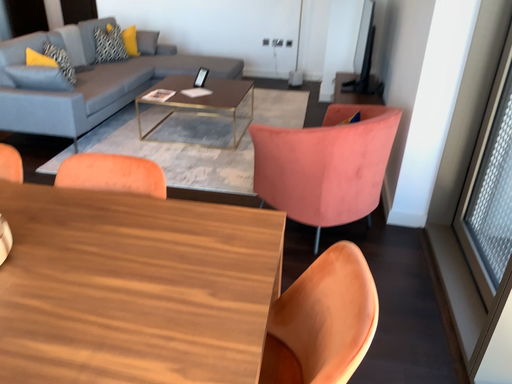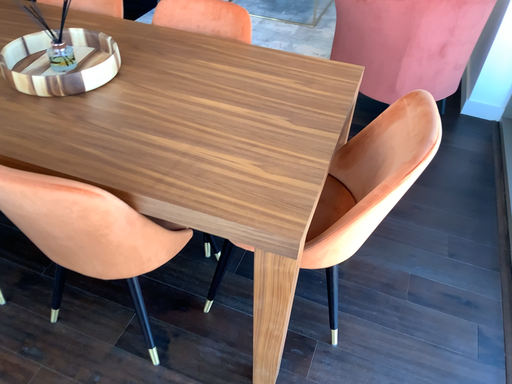
Question: Which way did the camera rotate in the video?

Choices:
 (A) rotated right
 (B) rotated left

Answer: (B)